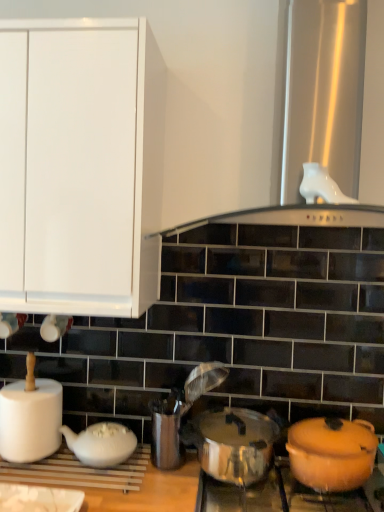
Describe the element at coordinates (275, 495) in the screenshot. I see `shiny metallic pot at lower right` at that location.

This screenshot has height=512, width=384. What do you see at coordinates (332, 453) in the screenshot?
I see `orange matte pot at lower right` at bounding box center [332, 453].

Find the location of `metallic silver utensil holder at center`. metallic silver utensil holder at center is located at coordinates coord(180,413).

Can we say white matte teapot at lower left lies outside metallic silver utensil holder at center?

Yes, white matte teapot at lower left is outside of metallic silver utensil holder at center.

Considering the positions of objects white matte teapot at lower left and metallic silver utensil holder at center in the image provided, who is more to the right, white matte teapot at lower left or metallic silver utensil holder at center?

metallic silver utensil holder at center is more to the right.

From a real-world perspective, is white matte teapot at lower left beneath metallic silver utensil holder at center?

Yes, from a real-world perspective, white matte teapot at lower left is under metallic silver utensil holder at center.

At what (x,y) coordinates should I click in order to perform the action: click on tableware on the left of metallic silver utensil holder at center. Please return your answer as a coordinate pair (x, y). This screenshot has width=384, height=512. Looking at the image, I should click on (101, 444).

Consider the image. Is white glossy vent at upper center positioned beyond the bounds of white matte teapot at lower left?

white glossy vent at upper center lies outside white matte teapot at lower left's area.

Based on the photo, does white glossy vent at upper center have a smaller size compared to white matte teapot at lower left?

Incorrect, white glossy vent at upper center is not smaller in size than white matte teapot at lower left.

At what (x,y) coordinates should I click in order to perform the action: click on vent on the right of white matte teapot at lower left. Please return your answer as a coordinate pair (x, y). Looking at the image, I should click on (222, 106).

In the image, is white glossy vent at upper center positioned in front of or behind white matte teapot at lower left?

white glossy vent at upper center is in front of white matte teapot at lower left.

Would you consider white glossy vent at upper center to be distant from metallic silver crock pot at center?

white glossy vent at upper center is actually quite close to metallic silver crock pot at center.

Between point (215, 40) and point (268, 430), which one is positioned behind?

The point (215, 40) is farther from the camera.

From a real-world perspective, does white glossy vent at upper center stand above metallic silver crock pot at center?

Yes, from a real-world perspective, white glossy vent at upper center is on top of metallic silver crock pot at center.

From the image's perspective, would you say white glossy vent at upper center is positioned over metallic silver crock pot at center?

Yes, from the image's perspective, white glossy vent at upper center is on top of metallic silver crock pot at center.

Is point (27, 409) positioned before point (281, 483)?

No, (27, 409) is behind (281, 483).

Consider the image. Which object is wider, white matte paper towel at left or shiny metallic pot at lower right?

With larger width is shiny metallic pot at lower right.

From the image's perspective, would you say white matte paper towel at left is shown under shiny metallic pot at lower right?

No.

Locate an element on the screen. The width and height of the screenshot is (384, 512). gas stove in front of the white matte paper towel at left is located at coordinates (275, 495).

Identify the location of kitchen appliance that is in front of the white matte teapot at lower left. The image size is (384, 512). (332, 453).

In the scene shown: Based on their sizes in the image, would you say orange matte pot at lower right is bigger or smaller than white matte teapot at lower left?

Considering their sizes, orange matte pot at lower right takes up more space than white matte teapot at lower left.

Between orange matte pot at lower right and white matte teapot at lower left, which one has less height?

Standing shorter between the two is white matte teapot at lower left.

Are orange matte pot at lower right and white matte teapot at lower left located far from each other?

No.

How different are the orientations of metallic silver crock pot at center and white matte teapot at lower left in degrees?

There is a 0.667-degree angle between the facing directions of metallic silver crock pot at center and white matte teapot at lower left.

Does metallic silver crock pot at center have a larger size compared to white matte teapot at lower left?

Correct, metallic silver crock pot at center is larger in size than white matte teapot at lower left.

Would you say metallic silver crock pot at center is outside white matte teapot at lower left?

metallic silver crock pot at center is positioned outside white matte teapot at lower left.

Considering the positions of objects orange matte pot at lower right and white matte paper towel at left in the image provided, who is behind, orange matte pot at lower right or white matte paper towel at left?

white matte paper towel at left is further from the camera.

Between orange matte pot at lower right and white matte paper towel at left, which one has larger size?

white matte paper towel at left.

Where is `kitchen appliance on the right of white matte paper towel at left`? Image resolution: width=384 pixels, height=512 pixels. kitchen appliance on the right of white matte paper towel at left is located at coordinates (332, 453).

The image size is (384, 512). What are the coordinates of `appliance on the right of white matte teapot at lower left` in the screenshot? It's located at (180, 413).

Locate an element on the screen. The image size is (384, 512). vent above the white matte teapot at lower left (from the image's perspective) is located at coordinates (222, 106).

When comparing their distances from white matte teapot at lower left, does metallic silver crock pot at center or white glossy vent at upper center seem closer?

metallic silver crock pot at center.

From the image, which object appears to be farther from metallic silver utensil holder at center, white matte teapot at lower left or orange matte pot at lower right?

orange matte pot at lower right.

Which object lies further to the anchor point white glossy vent at upper center, metallic silver utensil holder at center or metallic silver crock pot at center?

metallic silver crock pot at center is further to white glossy vent at upper center.

Which object lies further to the anchor point metallic silver crock pot at center, white matte paper towel at left or orange matte pot at lower right?

white matte paper towel at left is positioned further to the anchor metallic silver crock pot at center.

Based on their spatial positions, is shiny metallic pot at lower right or metallic silver utensil holder at center further from white matte teapot at lower left?

shiny metallic pot at lower right is positioned further to the anchor white matte teapot at lower left.

When comparing their distances from metallic silver crock pot at center, does shiny metallic pot at lower right or orange matte pot at lower right seem further?

The object further to metallic silver crock pot at center is orange matte pot at lower right.

Looking at the image, which one is located further to white glossy vent at upper center, metallic silver utensil holder at center or shiny metallic pot at lower right?

shiny metallic pot at lower right lies further to white glossy vent at upper center than the other object.

From the image, which object appears to be farther from white matte teapot at lower left, white glossy vent at upper center or white matte paper towel at left?

white glossy vent at upper center lies further to white matte teapot at lower left than the other object.

I want to click on appliance between white glossy vent at upper center and metallic silver crock pot at center in the vertical direction, so click(x=180, y=413).

This screenshot has width=384, height=512. I want to click on crock pot between white matte paper towel at left and orange matte pot at lower right in the horizontal direction, so click(x=232, y=443).

The image size is (384, 512). What are the coordinates of `appliance between white matte paper towel at left and metallic silver crock pot at center` in the screenshot? It's located at (180, 413).

Image resolution: width=384 pixels, height=512 pixels. Find the location of `crock pot between white glossy vent at upper center and shiny metallic pot at lower right vertically`. crock pot between white glossy vent at upper center and shiny metallic pot at lower right vertically is located at coordinates (232, 443).